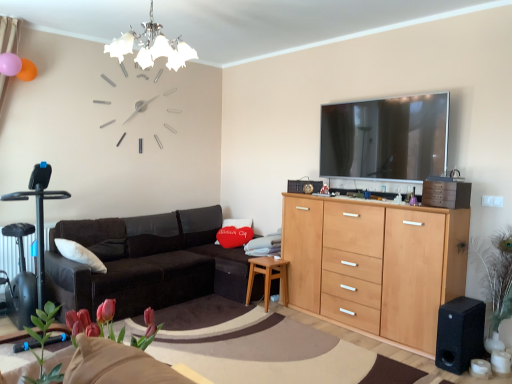
Question: Is chrome/textured glass chandelier at upper center not within black leather couch at center?

Choices:
 (A) yes
 (B) no

Answer: (A)

Question: From a real-world perspective, is chrome/textured glass chandelier at upper center on top of black leather couch at center?

Choices:
 (A) no
 (B) yes

Answer: (B)

Question: From the image's perspective, is chrome/textured glass chandelier at upper center above black leather couch at center?

Choices:
 (A) yes
 (B) no

Answer: (A)

Question: Considering the relative sizes of chrome/textured glass chandelier at upper center and black leather couch at center in the image provided, is chrome/textured glass chandelier at upper center taller than black leather couch at center?

Choices:
 (A) yes
 (B) no

Answer: (B)

Question: Are chrome/textured glass chandelier at upper center and black leather couch at center located far from each other?

Choices:
 (A) no
 (B) yes

Answer: (B)

Question: From the image's perspective, is chrome/textured glass chandelier at upper center beneath black leather couch at center?

Choices:
 (A) yes
 (B) no

Answer: (B)

Question: Can you confirm if black matte speaker at lower right is wider than green leafy plant at right, placed as the 3th plant when sorted from front to back?

Choices:
 (A) yes
 (B) no

Answer: (A)

Question: Is black matte speaker at lower right oriented towards green leafy plant at right, the 1th plant when ordered from back to front?

Choices:
 (A) yes
 (B) no

Answer: (B)

Question: Does black matte speaker at lower right lie behind green leafy plant at right, which is the third plant from left to right?

Choices:
 (A) yes
 (B) no

Answer: (A)

Question: From a real-world perspective, is black matte speaker at lower right below green leafy plant at right, which ranks as the 1th plant in right-to-left order?

Choices:
 (A) yes
 (B) no

Answer: (A)

Question: Can you confirm if black matte speaker at lower right is smaller than green leafy plant at right, placed as the 3th plant when sorted from front to back?

Choices:
 (A) no
 (B) yes

Answer: (B)

Question: Considering the relative positions of black matte speaker at lower right and green leafy plant at right, which is the third plant from left to right, in the image provided, is black matte speaker at lower right to the left of green leafy plant at right, which is the third plant from left to right, from the viewer's perspective?

Choices:
 (A) yes
 (B) no

Answer: (A)

Question: From the image's perspective, is black plastic swivel chair at left beneath light brown wooden side table at lower center?

Choices:
 (A) yes
 (B) no

Answer: (B)